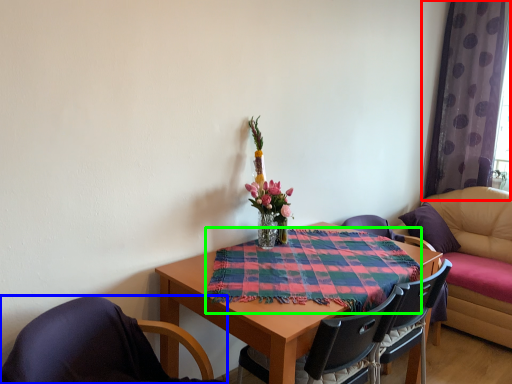
Question: Based on their relative distances, which object is farther from curtain (highlighted by a red box)? Choose from chair (highlighted by a blue box) and cloth (highlighted by a green box).

Choices:
 (A) chair
 (B) cloth

Answer: (A)